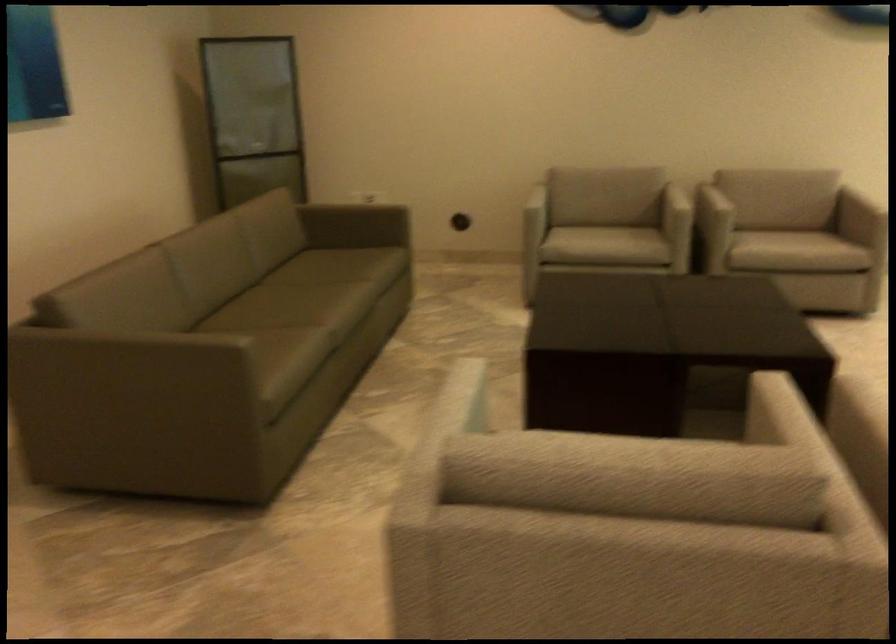
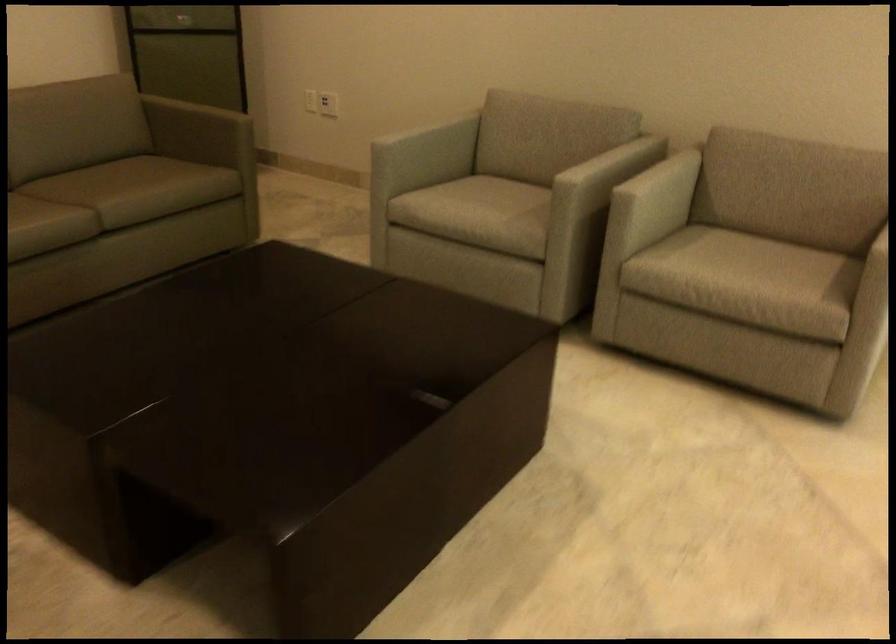
The point at (769, 232) is marked in the first image. Where is the corresponding point in the second image?

(739, 257)